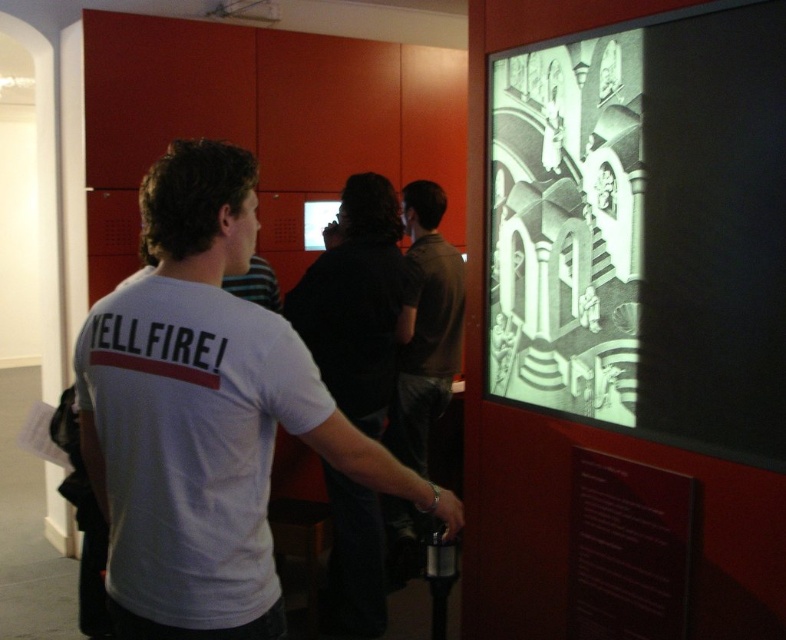
Question: Estimate the real-world distances between objects in this image. Which object is farther from the black matte shirt at center?

Choices:
 (A) monochrome paper artwork at center
 (B) dark brown shirt at center
 (C) white t-shirt at center

Answer: (C)

Question: Considering the relative positions of monochrome paper artwork at center and dark brown shirt at center in the image provided, where is monochrome paper artwork at center located with respect to dark brown shirt at center?

Choices:
 (A) right
 (B) left

Answer: (A)

Question: Does black matte shirt at center come in front of dark brown shirt at center?

Choices:
 (A) yes
 (B) no

Answer: (A)

Question: Does white t-shirt at center come behind black matte shirt at center?

Choices:
 (A) yes
 (B) no

Answer: (B)

Question: Estimate the real-world distances between objects in this image. Which object is closer to the dark brown shirt at center?

Choices:
 (A) monochrome paper artwork at center
 (B) white t-shirt at center
 (C) black matte shirt at center

Answer: (C)

Question: Among these points, which one is nearest to the camera?

Choices:
 (A) (119, 428)
 (B) (509, 220)
 (C) (403, 528)

Answer: (A)